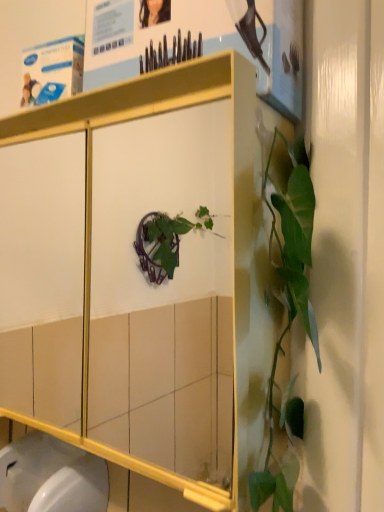
The image size is (384, 512). What do you see at coordinates (51, 476) in the screenshot?
I see `white glossy toilet bowl at lower left` at bounding box center [51, 476].

This screenshot has height=512, width=384. What are the coordinates of `matte paper poster at upper center` in the screenshot? It's located at (194, 38).

Is the surface of white glossy toilet bowl at lower left in direct contact with metallic white cabinet at center?

They are not placed beside each other.

Is white glossy toilet bowl at lower left oriented away from metallic white cabinet at center?

No, white glossy toilet bowl at lower left's orientation is not away from metallic white cabinet at center.

Is white glossy toilet bowl at lower left closer to the viewer compared to metallic white cabinet at center?

No, the depth of white glossy toilet bowl at lower left is greater than that of metallic white cabinet at center.

Is metallic white cabinet at center inside white glossy toilet bowl at lower left?

No.

From a real-world perspective, is white glossy toilet bowl at lower left positioned under matte paper poster at upper center based on gravity?

Yes.

Is white glossy toilet bowl at lower left completely or partially outside of matte paper poster at upper center?

white glossy toilet bowl at lower left is positioned outside matte paper poster at upper center.

Is white glossy toilet bowl at lower left facing away from matte paper poster at upper center?

white glossy toilet bowl at lower left does not have its back to matte paper poster at upper center.

In the image, is white glossy toilet bowl at lower left positioned in front of or behind matte paper poster at upper center?

Clearly, white glossy toilet bowl at lower left is behind matte paper poster at upper center.

The image size is (384, 512). What are the coordinates of `cabinetry on the right of the white glossy toilet bowl at lower left` in the screenshot? It's located at (92, 204).

Considering the relative positions of metallic white cabinet at center and white glossy toilet bowl at lower left in the image provided, is metallic white cabinet at center in front of white glossy toilet bowl at lower left?

Yes, it is in front of white glossy toilet bowl at lower left.

Is metallic white cabinet at center next to white glossy toilet bowl at lower left and touching it?

No, metallic white cabinet at center is not with white glossy toilet bowl at lower left.

Based on the photo, which object is positioned more to the left, metallic white cabinet at center or white glossy toilet bowl at lower left?

white glossy toilet bowl at lower left is more to the left.

Considering the sizes of objects matte paper poster at upper center and white glossy toilet bowl at lower left in the image provided, who is taller, matte paper poster at upper center or white glossy toilet bowl at lower left?

matte paper poster at upper center is taller.

Would you say matte paper poster at upper center contains white glossy toilet bowl at lower left?

No.

Considering the positions of objects matte paper poster at upper center and white glossy toilet bowl at lower left in the image provided, who is behind, matte paper poster at upper center or white glossy toilet bowl at lower left?

Positioned behind is white glossy toilet bowl at lower left.

In terms of width, does matte paper poster at upper center look wider or thinner when compared to white glossy toilet bowl at lower left?

In the image, matte paper poster at upper center appears to be more narrow than white glossy toilet bowl at lower left.

Consider the image. Which object is positioned more to the right, matte paper poster at upper center or metallic white cabinet at center?

matte paper poster at upper center.

Is there a large distance between matte paper poster at upper center and metallic white cabinet at center?

That's not correct — matte paper poster at upper center is a little close to metallic white cabinet at center.

In terms of size, does matte paper poster at upper center appear bigger or smaller than metallic white cabinet at center?

Considering their sizes, matte paper poster at upper center takes up less space than metallic white cabinet at center.

Considering the sizes of objects matte paper poster at upper center and metallic white cabinet at center in the image provided, who is thinner, matte paper poster at upper center or metallic white cabinet at center?

With smaller width is matte paper poster at upper center.

Does metallic white cabinet at center have a larger size compared to matte paper poster at upper center?

Correct, metallic white cabinet at center is larger in size than matte paper poster at upper center.

From a real-world perspective, who is located lower, metallic white cabinet at center or matte paper poster at upper center?

metallic white cabinet at center.

Which object is positioned more to the left, metallic white cabinet at center or matte paper poster at upper center?

metallic white cabinet at center.

In terms of height, does metallic white cabinet at center look taller or shorter compared to matte paper poster at upper center?

Considering their sizes, metallic white cabinet at center has more height than matte paper poster at upper center.

Where is `toilet bowl below the metallic white cabinet at center (from a real-world perspective)`? toilet bowl below the metallic white cabinet at center (from a real-world perspective) is located at coordinates 51,476.

Identify the location of toilet bowl on the left of the matte paper poster at upper center. This screenshot has height=512, width=384. (51, 476).

Which object lies nearer to the anchor point metallic white cabinet at center, matte paper poster at upper center or white glossy toilet bowl at lower left?

Based on the image, matte paper poster at upper center appears to be nearer to metallic white cabinet at center.

Consider the image. Considering their positions, is white glossy toilet bowl at lower left positioned further to matte paper poster at upper center than metallic white cabinet at center?

white glossy toilet bowl at lower left lies further to matte paper poster at upper center than the other object.

Looking at the image, which one is located further to white glossy toilet bowl at lower left, matte paper poster at upper center or metallic white cabinet at center?

matte paper poster at upper center lies further to white glossy toilet bowl at lower left than the other object.

Which object lies further to the anchor point white glossy toilet bowl at lower left, metallic white cabinet at center or matte paper poster at upper center?

matte paper poster at upper center.

Based on their spatial positions, is white glossy toilet bowl at lower left or matte paper poster at upper center closer to metallic white cabinet at center?

matte paper poster at upper center.

Considering their positions, is metallic white cabinet at center positioned further to matte paper poster at upper center than white glossy toilet bowl at lower left?

white glossy toilet bowl at lower left.

Find the location of a particular element. The width and height of the screenshot is (384, 512). cabinetry between matte paper poster at upper center and white glossy toilet bowl at lower left in the vertical direction is located at coordinates click(x=92, y=204).